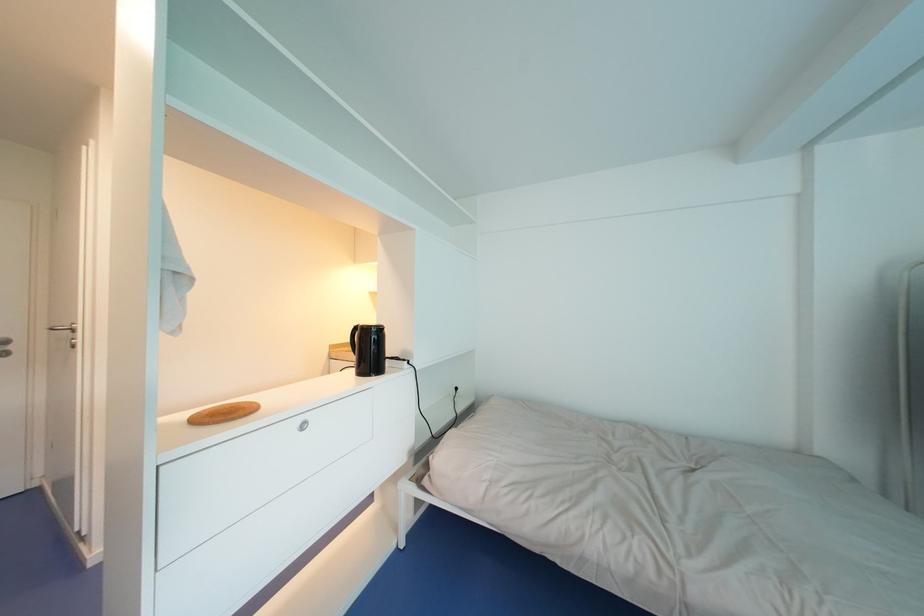
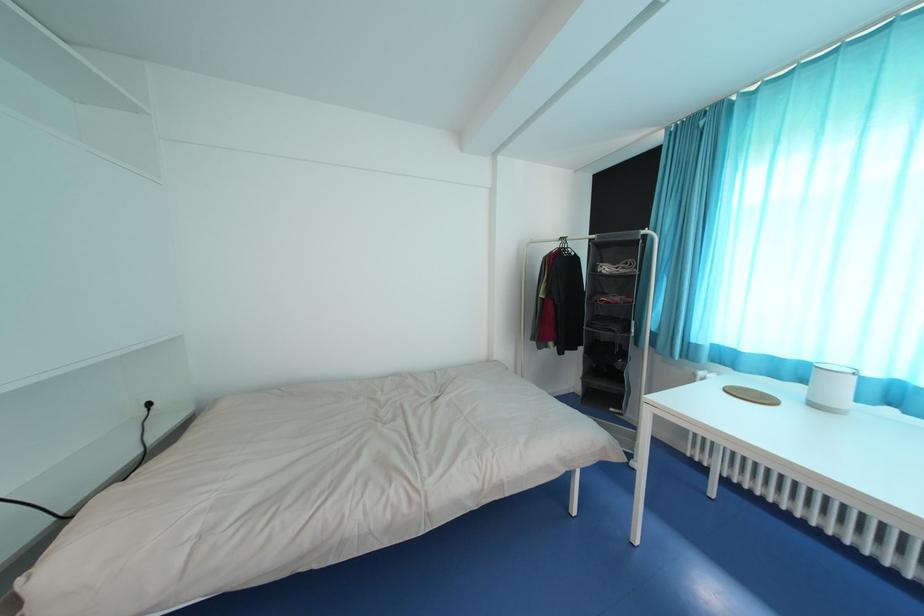
Question: How did the camera likely rotate?

Choices:
 (A) Left
 (B) Right
 (C) Up
 (D) Down

Answer: (B)